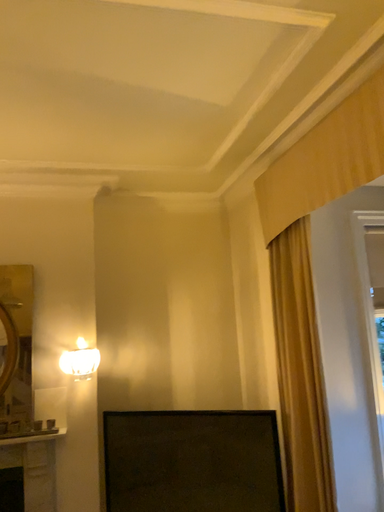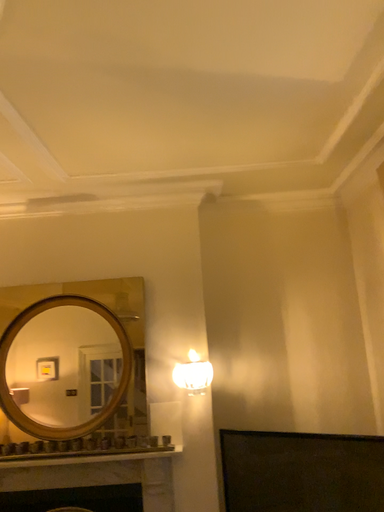
Question: How did the camera likely rotate when shooting the video?

Choices:
 (A) rotated left
 (B) rotated right

Answer: (A)